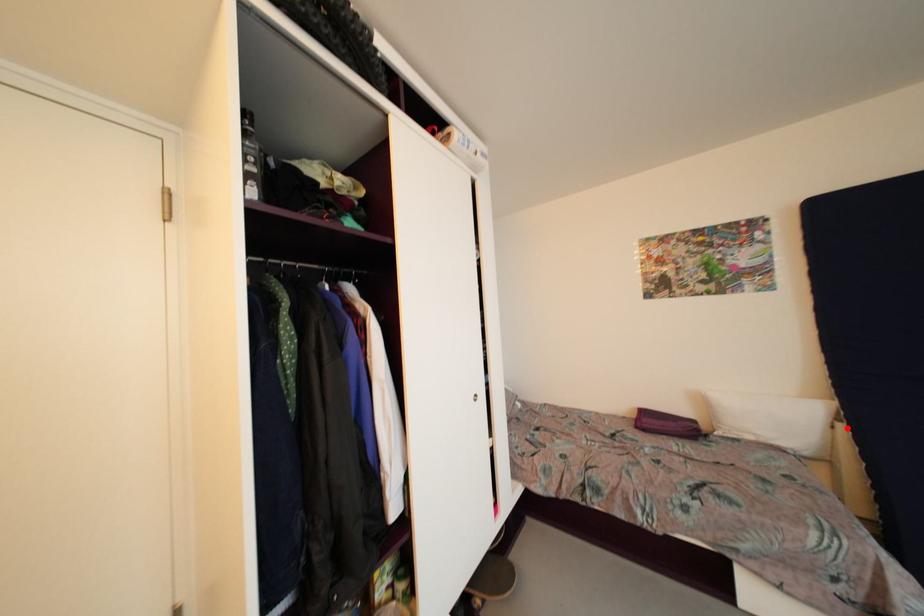
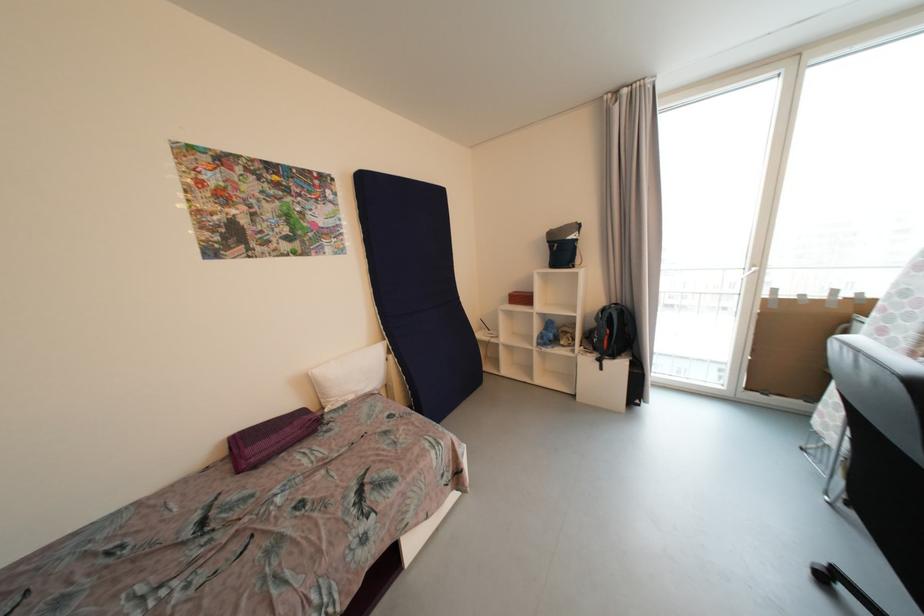
Question: I am providing you with two images of the same scene from different viewpoints. Given a red point in image1, look at the same physical point in image2. Is it:

Choices:
 (A) Closer to the viewpoint
 (B) Farther from the viewpoint

Answer: (B)